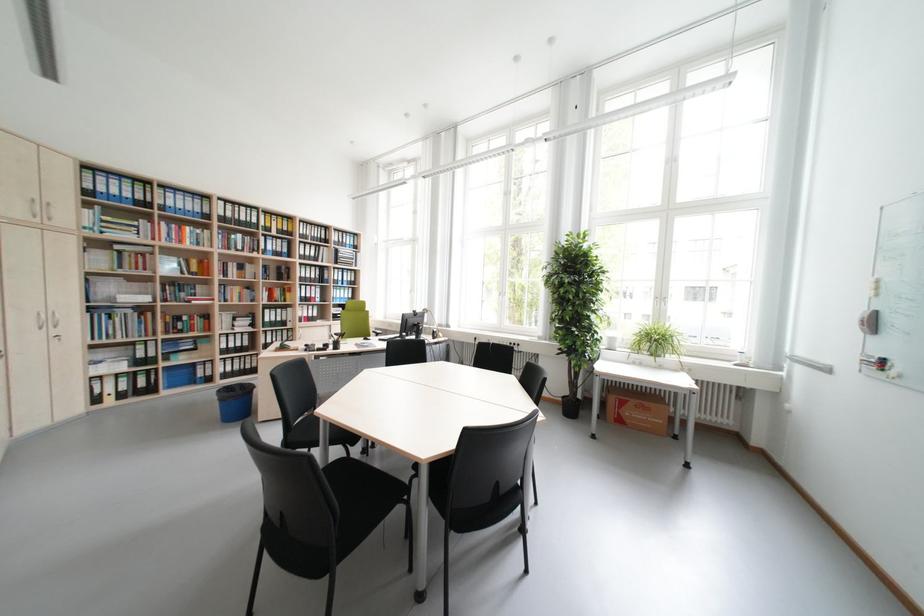
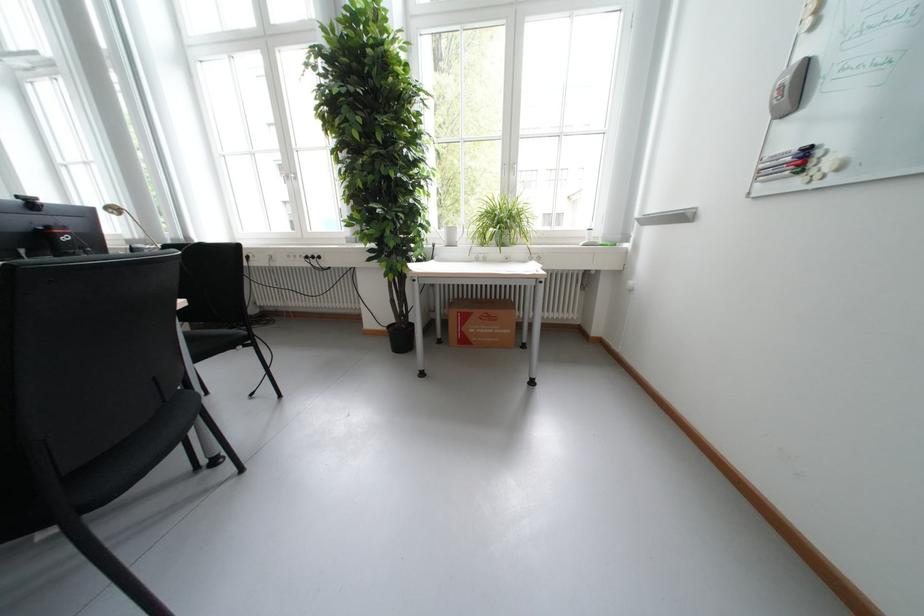
Locate, in the second image, the point that corresponds to (811,355) in the first image.

(664, 211)